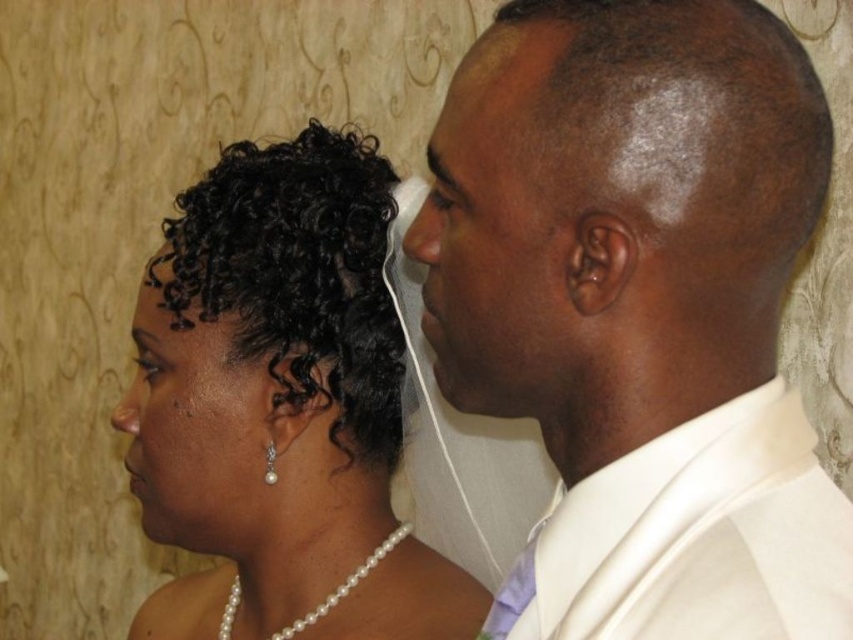
Looking at this image, is shiny white suit at right smaller than black pearl earring at lower left?

Actually, shiny white suit at right might be larger than black pearl earring at lower left.

This screenshot has width=853, height=640. Describe the element at coordinates (640, 310) in the screenshot. I see `shiny white suit at right` at that location.

Where is `shiny white suit at right`? The height and width of the screenshot is (640, 853). shiny white suit at right is located at coordinates (640, 310).

Does satin skin face at center appear over black pearl earring at lower left?

Correct, satin skin face at center is located above black pearl earring at lower left.

Looking at this image, is satin skin face at center smaller than black pearl earring at lower left?

Indeed, satin skin face at center has a smaller size compared to black pearl earring at lower left.

You are a GUI agent. You are given a task and a screenshot of the screen. Output one action in this format:
    pyautogui.click(x=<x>, y=<y>)
    Task: Click on the satin skin face at center
    
    Given the screenshot: What is the action you would take?
    pyautogui.click(x=492, y=230)

Identify the location of satin skin face at center. Image resolution: width=853 pixels, height=640 pixels. (492, 230).

Does shiny white suit at right come behind black pearl necklace at center?

No, shiny white suit at right is in front of black pearl necklace at center.

At what (x,y) coordinates should I click in order to perform the action: click on shiny white suit at right. Please return your answer as a coordinate pair (x, y). The image size is (853, 640). Looking at the image, I should click on (640, 310).